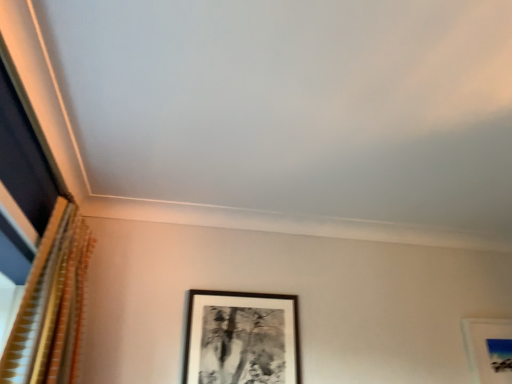
What is the approximate height of gold textured curtain at left?

gold textured curtain at left is 26.31 inches in height.

The image size is (512, 384). Identify the location of gold textured curtain at left. (51, 304).

Describe the element at coordinates (51, 304) in the screenshot. I see `gold textured curtain at left` at that location.

What do you see at coordinates (241, 338) in the screenshot? I see `black matte picture frame at center` at bounding box center [241, 338].

Measure the distance between point (220, 374) and camera.

Point (220, 374) and camera are 5.95 feet apart from each other.

Identify the location of black matte picture frame at center. (241, 338).

You are a GUI agent. You are given a task and a screenshot of the screen. Output one action in this format:
    pyautogui.click(x=<x>, y=<y>)
    Task: Click on the gold textured curtain at left
    The image size is (512, 384).
    Given the screenshot: What is the action you would take?
    pyautogui.click(x=51, y=304)

Is gold textured curtain at left at the left side of black matte picture frame at center?

Yes.

Relative to black matte picture frame at center, is gold textured curtain at left in front or behind?

gold textured curtain at left is in front of black matte picture frame at center.

Is point (39, 355) closer to viewer compared to point (245, 329)?

Yes.

From the image's perspective, between gold textured curtain at left and black matte picture frame at center, which one is located above?

From the image's view, gold textured curtain at left is above.

Looking at this image, from a real-world perspective, who is located lower, gold textured curtain at left or black matte picture frame at center?

From a 3D spatial view, black matte picture frame at center is below.

Which object is thinner, gold textured curtain at left or black matte picture frame at center?

With smaller width is black matte picture frame at center.

Considering the sizes of objects gold textured curtain at left and black matte picture frame at center in the image provided, who is taller, gold textured curtain at left or black matte picture frame at center?

gold textured curtain at left.

Can you confirm if gold textured curtain at left is bigger than black matte picture frame at center?

Yes, gold textured curtain at left is bigger than black matte picture frame at center.

Do you think gold textured curtain at left is within black matte picture frame at center, or outside of it?

gold textured curtain at left is outside black matte picture frame at center.

From the picture: Is gold textured curtain at left not near black matte picture frame at center?

No.

Is black matte picture frame at center at the back of gold textured curtain at left?

No, gold textured curtain at left's orientation is not away from black matte picture frame at center.

How different are the orientations of gold textured curtain at left and black matte picture frame at center in degrees?

84.9 degrees separate the facing orientations of gold textured curtain at left and black matte picture frame at center.

Identify the location of picture frame that is on the right side of gold textured curtain at left. Image resolution: width=512 pixels, height=384 pixels. (241, 338).

Visually, is black matte picture frame at center positioned to the left or to the right of gold textured curtain at left?

Clearly, black matte picture frame at center is on the right of gold textured curtain at left in the image.

Which object is further away from the camera, black matte picture frame at center or gold textured curtain at left?

black matte picture frame at center is further away from the camera.

Which is less distant, (x=275, y=378) or (x=42, y=357)?

Positioned in front is point (x=42, y=357).

From the image's perspective, which is above, black matte picture frame at center or gold textured curtain at left?

From the image's view, gold textured curtain at left is above.

From a real-world perspective, which is physically above, black matte picture frame at center or gold textured curtain at left?

From a 3D spatial view, gold textured curtain at left is above.

Looking at this image, which object is thinner, black matte picture frame at center or gold textured curtain at left?

Thinner between the two is black matte picture frame at center.

Based on the photo, considering the sizes of objects black matte picture frame at center and gold textured curtain at left in the image provided, who is shorter, black matte picture frame at center or gold textured curtain at left?

black matte picture frame at center.

Is black matte picture frame at center bigger or smaller than gold textured curtain at left?

black matte picture frame at center is smaller than gold textured curtain at left.

Is black matte picture frame at center located outside gold textured curtain at left?

Yes, black matte picture frame at center is not within gold textured curtain at left.

Does black matte picture frame at center touch gold textured curtain at left?

black matte picture frame at center and gold textured curtain at left are clearly separated.

Is black matte picture frame at center facing away from gold textured curtain at left?

That's not correct — black matte picture frame at center is not looking away from gold textured curtain at left.

Measure the distance from black matte picture frame at center to gold textured curtain at left.

A distance of 25.94 inches exists between black matte picture frame at center and gold textured curtain at left.

Where is `picture frame lying behind the gold textured curtain at left`? Image resolution: width=512 pixels, height=384 pixels. picture frame lying behind the gold textured curtain at left is located at coordinates (241, 338).

Find the location of a particular element. The width and height of the screenshot is (512, 384). picture frame lying below the gold textured curtain at left (from the image's perspective) is located at coordinates pos(241,338).

I want to click on curtain that is on the left side of black matte picture frame at center, so click(51, 304).